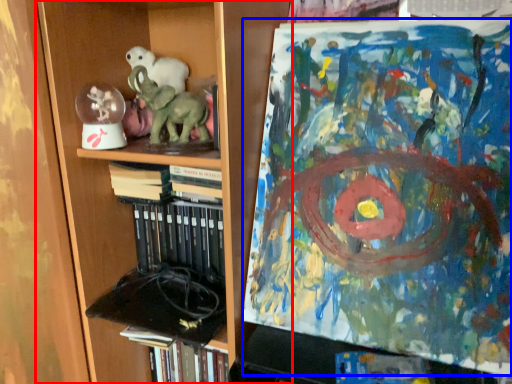
Question: Among these objects, which one is nearest to the camera, bookcase (highlighted by a red box) or art (highlighted by a blue box)?

Choices:
 (A) bookcase
 (B) art

Answer: (B)